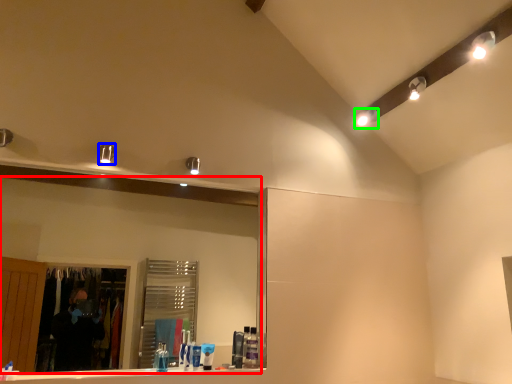
Question: Which is farther away from mirror (highlighted by a red box)? light fixture (highlighted by a blue box) or lighting (highlighted by a green box)?

Choices:
 (A) light fixture
 (B) lighting

Answer: (B)